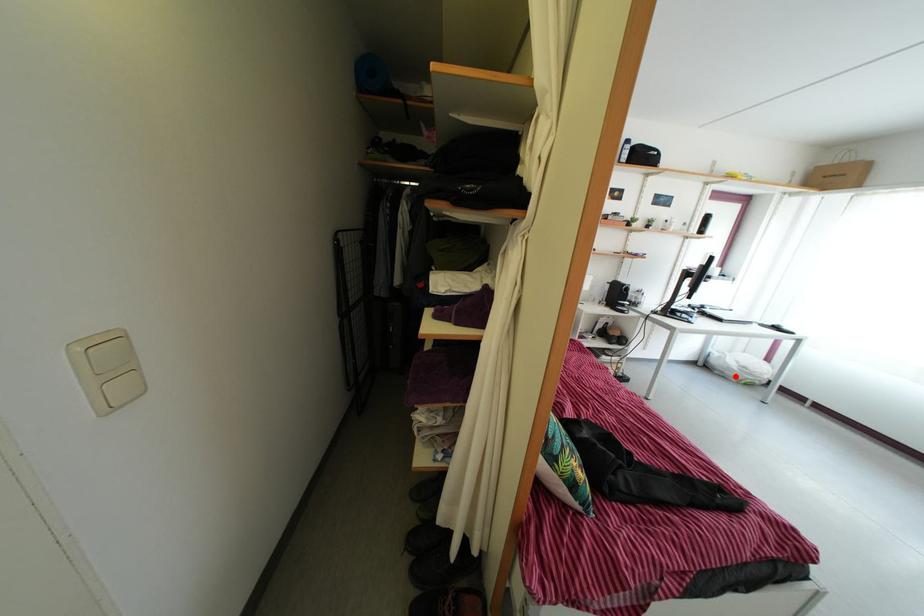
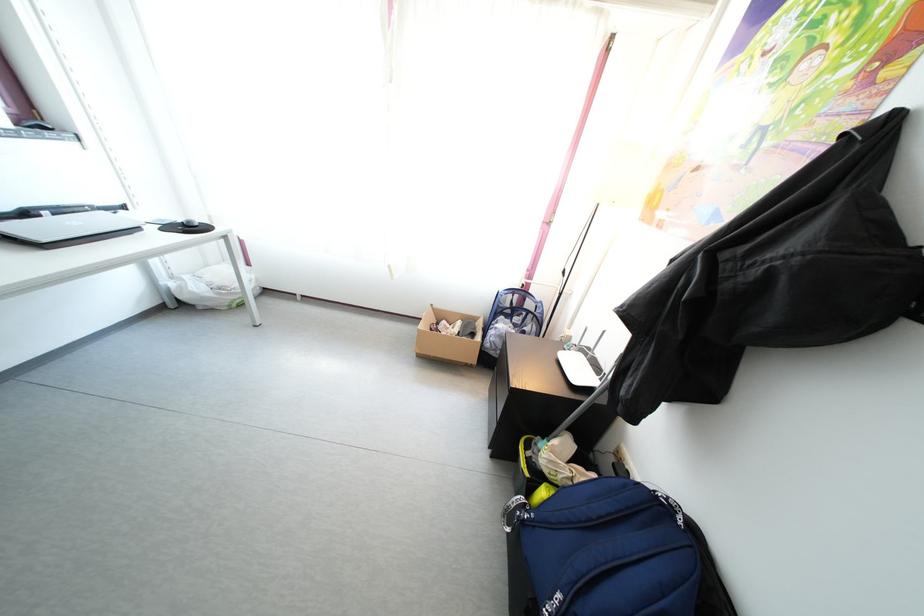
Where in the second image is the point corresponding to the highlighted location from the first image?

(210, 306)